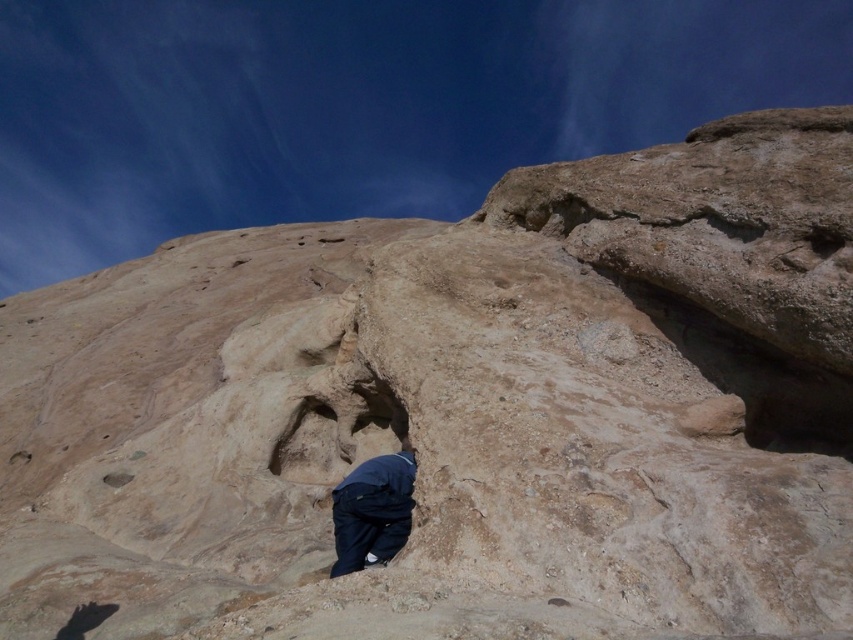
Between smooth sandstone hole at upper right and brown rough hole at lower left, which one has less height?

With less height is brown rough hole at lower left.

Does point (815, 252) come in front of point (119, 476)?

Yes.

Identify the location of smooth sandstone hole at upper right. The height and width of the screenshot is (640, 853). pyautogui.click(x=824, y=241).

Is dark blue fabric at lower center shorter than smooth sandstone hole at upper right?

Correct, dark blue fabric at lower center is not as tall as smooth sandstone hole at upper right.

Who is more distant from viewer, [345,529] or [822,259]?

→ The point [345,529] is more distant.

Is point (354, 474) positioned behind point (836, 248)?

That is True.

Image resolution: width=853 pixels, height=640 pixels. I want to click on dark blue fabric at lower center, so click(372, 509).

Does dark blue fabric at lower center lie in front of brown rough hole at lower left?

Yes, dark blue fabric at lower center is closer to the viewer.

Which is more to the left, dark blue fabric at lower center or brown rough hole at lower left?

Positioned to the left is brown rough hole at lower left.

Find the location of a particular element. The image size is (853, 640). dark blue fabric at lower center is located at coordinates (372, 509).